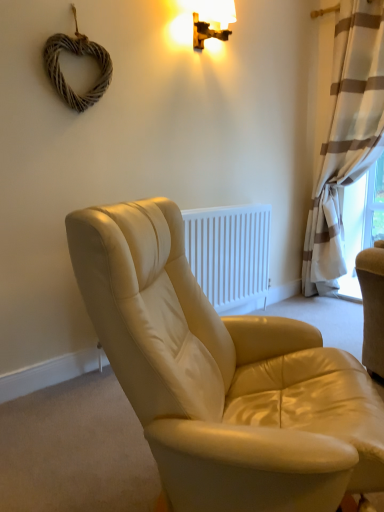
Question: Would you say leather chair at center is a long distance from white striped curtain at right?

Choices:
 (A) no
 (B) yes

Answer: (B)

Question: Does leather chair at center touch white striped curtain at right?

Choices:
 (A) yes
 (B) no

Answer: (B)

Question: Is leather chair at center not within white striped curtain at right?

Choices:
 (A) yes
 (B) no

Answer: (A)

Question: Is the depth of leather chair at center greater than that of white striped curtain at right?

Choices:
 (A) yes
 (B) no

Answer: (B)

Question: Is leather chair at center smaller than white striped curtain at right?

Choices:
 (A) no
 (B) yes

Answer: (B)

Question: Is white striped curtain at right wider or thinner than wooden wall sconce at upper center?

Choices:
 (A) thin
 (B) wide

Answer: (B)

Question: Considering the positions of point (360, 148) and point (225, 23), is point (360, 148) closer or farther from the camera than point (225, 23)?

Choices:
 (A) closer
 (B) farther

Answer: (B)

Question: Relative to wooden wall sconce at upper center, is white striped curtain at right in front or behind?

Choices:
 (A) behind
 (B) front

Answer: (A)

Question: Is white striped curtain at right to the left or to the right of wooden wall sconce at upper center in the image?

Choices:
 (A) right
 (B) left

Answer: (A)

Question: From the image's perspective, is leather chair at center located above or below woven wood heart at upper left?

Choices:
 (A) above
 (B) below

Answer: (B)

Question: Considering the positions of leather chair at center and woven wood heart at upper left in the image, is leather chair at center taller or shorter than woven wood heart at upper left?

Choices:
 (A) short
 (B) tall

Answer: (A)

Question: Considering the positions of leather chair at center and woven wood heart at upper left in the image, is leather chair at center wider or thinner than woven wood heart at upper left?

Choices:
 (A) wide
 (B) thin

Answer: (A)

Question: Is leather chair at center bigger or smaller than woven wood heart at upper left?

Choices:
 (A) big
 (B) small

Answer: (A)

Question: In the image, is woven wood heart at upper left positioned in front of or behind wooden wall sconce at upper center?

Choices:
 (A) front
 (B) behind

Answer: (A)

Question: Does point (102, 77) appear closer or farther from the camera than point (195, 47)?

Choices:
 (A) farther
 (B) closer

Answer: (B)